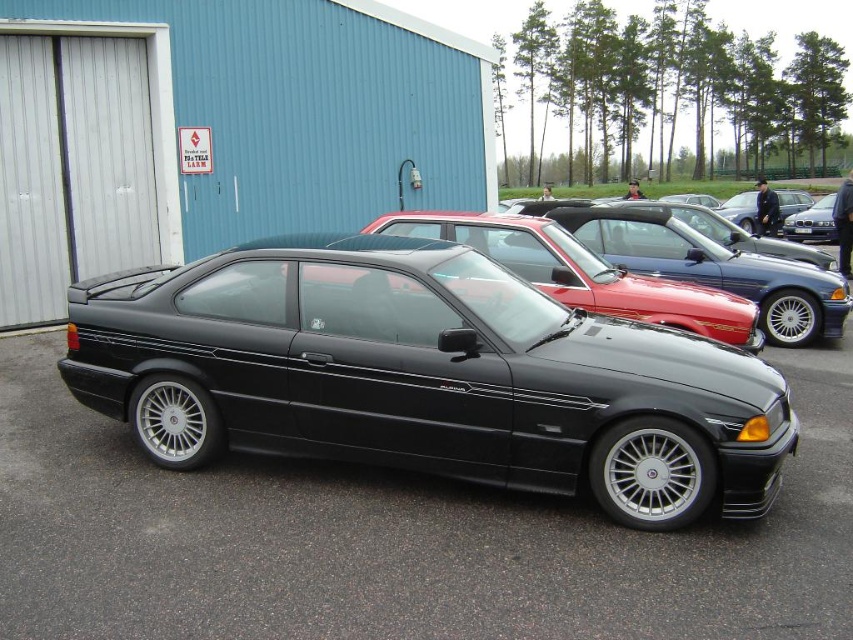
Is glossy black sedan at center thinner than shiny metallic car at center?

Yes.

How far apart are glossy black sedan at center and shiny metallic car at center?

They are 14.20 meters apart.

Locate an element on the screen. glossy black sedan at center is located at coordinates (582, 273).

Can you confirm if glossy black car at center is taller than satin black car at center?

No, glossy black car at center is not taller than satin black car at center.

Describe the element at coordinates (426, 376) in the screenshot. This screenshot has height=640, width=853. I see `glossy black car at center` at that location.

Describe the element at coordinates (426, 376) in the screenshot. I see `glossy black car at center` at that location.

Where is `glossy black car at center`? The width and height of the screenshot is (853, 640). glossy black car at center is located at coordinates (426, 376).

Who is more forward, (x=612, y=289) or (x=814, y=237)?

Point (x=612, y=289) is more forward.

From the picture: Can you confirm if glossy black sedan at center is smaller than satin black car at center?

Correct, glossy black sedan at center occupies less space than satin black car at center.

Does point (405, 211) come behind point (801, 236)?

No, (405, 211) is in front of (801, 236).

The width and height of the screenshot is (853, 640). In order to click on glossy black sedan at center in this screenshot , I will do `click(582, 273)`.